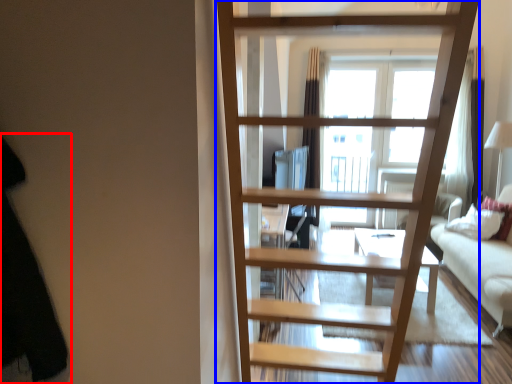
Question: Which of the following is the farthest to the observer, dark (highlighted by a red box) or ladder (highlighted by a blue box)?

Choices:
 (A) dark
 (B) ladder

Answer: (B)